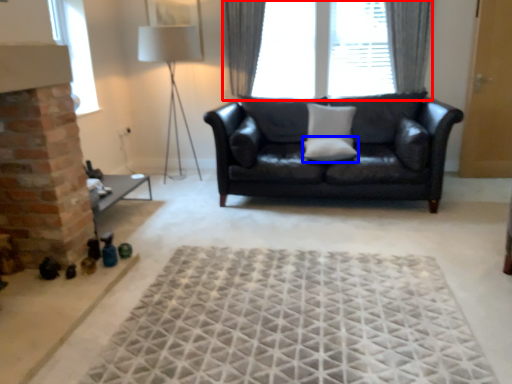
Question: Which object is closer to the camera taking this photo, window (highlighted by a red box) or pillow (highlighted by a blue box)?

Choices:
 (A) window
 (B) pillow

Answer: (B)